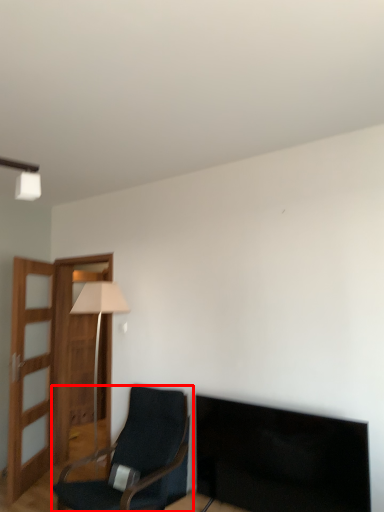
Question: From the image's perspective, where is chair (annotated by the red box) located relative to table lamp?

Choices:
 (A) below
 (B) above

Answer: (A)